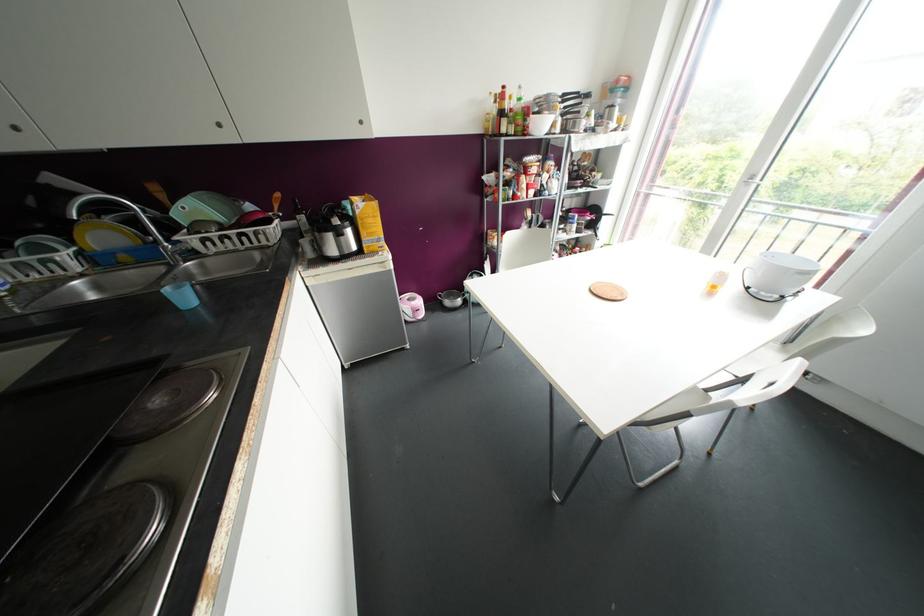
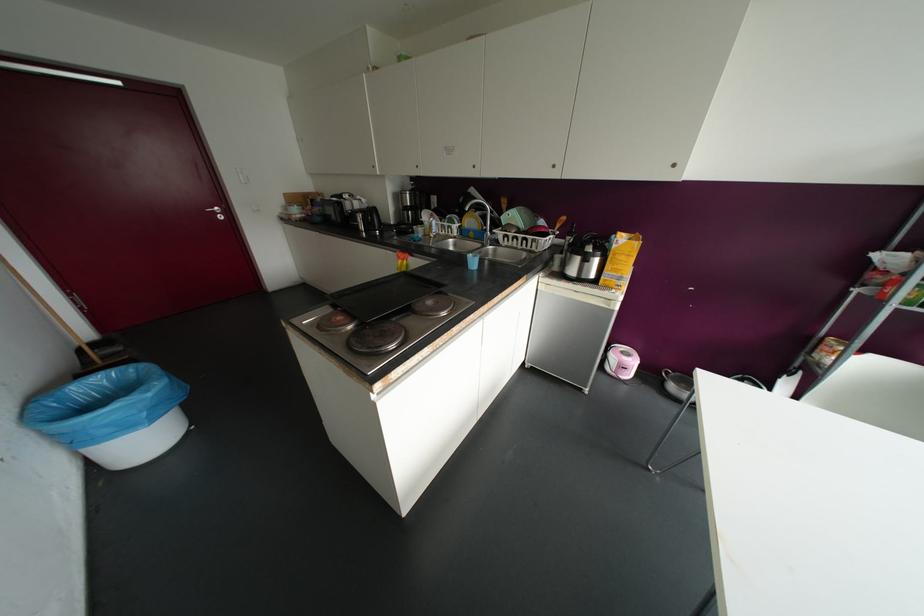
Question: The camera is either moving clockwise (left) or counter-clockwise (right) around the object. The first image is from the beginning of the video and the second image is from the end. Is the camera moving left or right when shooting the video?

Choices:
 (A) Left
 (B) Right

Answer: (B)